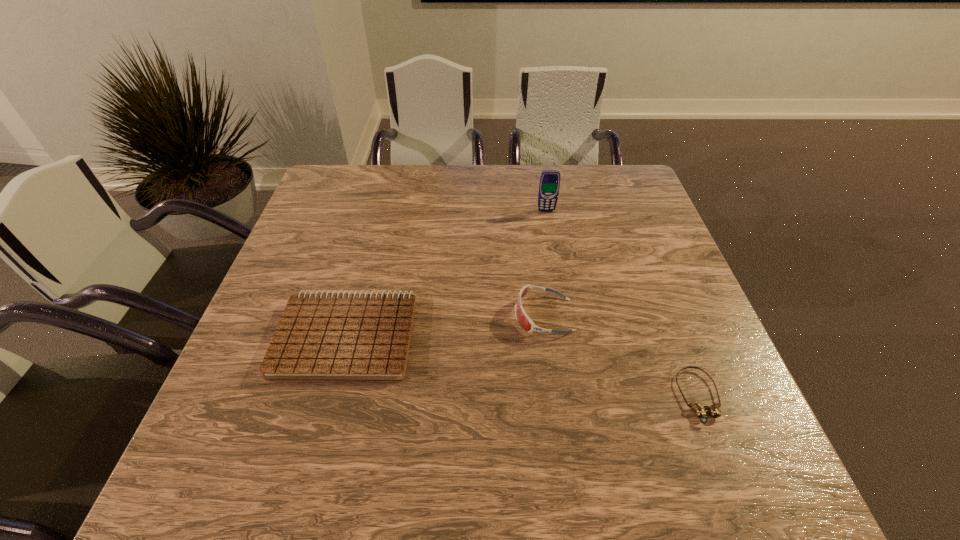
You are a GUI agent. You are given a task and a screenshot of the screen. Output one action in this format:
    pyautogui.click(x=<x>, y=<y>)
    Task: Click on the free region located 0.170m on the front-facing side of the left goggles
    The height and width of the screenshot is (540, 960).
    Given the screenshot: What is the action you would take?
    pyautogui.click(x=440, y=315)

Find the location of `free space located 0.250m on the front-facing side of the left goggles`. free space located 0.250m on the front-facing side of the left goggles is located at coordinates (405, 315).

The width and height of the screenshot is (960, 540). I want to click on vacant space located on the back of the leftmost object, so click(x=380, y=209).

Find the location of a particular element. The image size is (960, 540). free space located 0.080m on the front lenses and sides of the shorter goggles is located at coordinates (727, 470).

Image resolution: width=960 pixels, height=540 pixels. Identify the location of object that is at the left edge. (321, 336).

What are the coordinates of `object located at the right edge` in the screenshot? It's located at (699, 409).

The height and width of the screenshot is (540, 960). Identify the location of blank area at the far edge. (510, 197).

This screenshot has height=540, width=960. Find the location of `free point at the near edge`. free point at the near edge is located at coordinates (634, 482).

In the image, there is a desktop. Where is `vacant area at the left edge`? The image size is (960, 540). vacant area at the left edge is located at coordinates (278, 320).

The height and width of the screenshot is (540, 960). Identify the location of vacant space at the right edge of the desktop. (635, 309).